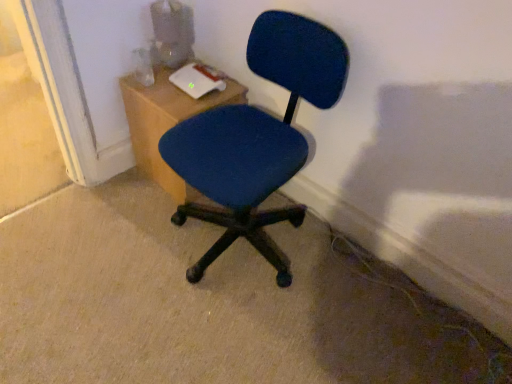
Where is `vacant region to the right of blue fabric chair at center`? This screenshot has width=512, height=384. vacant region to the right of blue fabric chair at center is located at coordinates (366, 295).